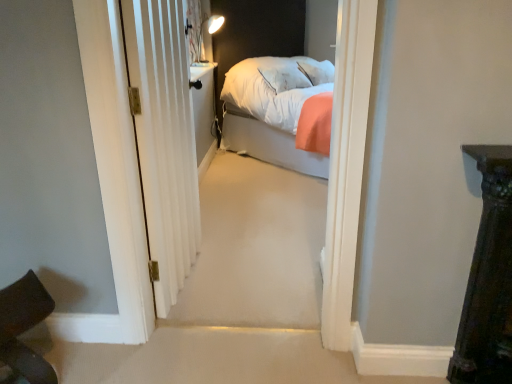
Where is `white textured door at center`? This screenshot has height=384, width=512. white textured door at center is located at coordinates (165, 139).

Describe the element at coordinates (165, 139) in the screenshot. I see `white textured door at center` at that location.

Describe the element at coordinates (24, 329) in the screenshot. I see `dark brown leather chair at lower left` at that location.

You are a GUI agent. You are given a task and a screenshot of the screen. Output one action in this format:
    pyautogui.click(x=<x>, y=<y>)
    Task: Click on the dark brown leather chair at lower left
    The height and width of the screenshot is (384, 512).
    Given the screenshot: What is the action you would take?
    pyautogui.click(x=24, y=329)

Locate an element on the screen. The image size is (512, 384). white textured door at center is located at coordinates click(165, 139).

Is dark brown leather chair at lower left to the right of white textured door at center from the viewer's perspective?

Incorrect, dark brown leather chair at lower left is not on the right side of white textured door at center.

Is dark brown leather chair at lower left positioned behind white textured door at center?

No.

Is point (1, 321) closer or farther from the camera than point (188, 217)?

Point (1, 321).

From the image's perspective, between dark brown leather chair at lower left and white textured door at center, who is located below?

dark brown leather chair at lower left, from the image's perspective.

From a real-world perspective, between dark brown leather chair at lower left and white textured door at center, who is vertically lower?

From a 3D spatial view, dark brown leather chair at lower left is below.

Can you confirm if dark brown leather chair at lower left is wider than white textured door at center?

Yes.

Between dark brown leather chair at lower left and white textured door at center, which one has more height?

Standing taller between the two is white textured door at center.

Between dark brown leather chair at lower left and white textured door at center, which one has larger size?

white textured door at center is bigger.

Is dark brown leather chair at lower left not within white textured door at center?

That's correct, dark brown leather chair at lower left is outside of white textured door at center.

Does dark brown leather chair at lower left touch white textured door at center?

There is a gap between dark brown leather chair at lower left and white textured door at center.

Is dark brown leather chair at lower left positioned with its back to white textured door at center?

No, dark brown leather chair at lower left is not facing away from white textured door at center.

How much distance is there between dark brown leather chair at lower left and white textured door at center?

They are 27.90 inches apart.

Image resolution: width=512 pixels, height=384 pixels. I want to click on door behind the dark brown leather chair at lower left, so click(x=165, y=139).

Is white textured door at center at the right side of dark brown leather chair at lower left?

Yes.

In the scene shown: Which is in front, white textured door at center or dark brown leather chair at lower left?

Positioned in front is dark brown leather chair at lower left.

Does point (160, 90) come farther from viewer compared to point (26, 362)?

That is True.

From the image's perspective, is white textured door at center positioned above or below dark brown leather chair at lower left?

Clearly, from the image's perspective, white textured door at center is above dark brown leather chair at lower left.

From a real-world perspective, between white textured door at center and dark brown leather chair at lower left, who is vertically higher?

In real-world perspective, white textured door at center is above.

Considering the sizes of white textured door at center and dark brown leather chair at lower left in the image, is white textured door at center wider or thinner than dark brown leather chair at lower left?

In the image, white textured door at center appears to be more narrow than dark brown leather chair at lower left.

Is white textured door at center taller than dark brown leather chair at lower left?

Correct, white textured door at center is much taller as dark brown leather chair at lower left.

Based on their sizes in the image, would you say white textured door at center is bigger or smaller than dark brown leather chair at lower left?

white textured door at center is bigger than dark brown leather chair at lower left.

Can we say white textured door at center lies outside dark brown leather chair at lower left?

Yes, white textured door at center is not within dark brown leather chair at lower left.

Can you see white textured door at center touching dark brown leather chair at lower left?

No, white textured door at center is not touching dark brown leather chair at lower left.

Is white textured door at center facing towards dark brown leather chair at lower left?

No, white textured door at center is not oriented towards dark brown leather chair at lower left.

What's the angular difference between white textured door at center and dark brown leather chair at lower left's facing directions?

white textured door at center and dark brown leather chair at lower left are facing 45.3 degrees away from each other.

Find the location of a particular element. This screenshot has height=384, width=512. door above the dark brown leather chair at lower left (from the image's perspective) is located at coordinates (165, 139).

In the image, there is a dark brown leather chair at lower left. Where is `door above it (from the image's perspective)`? Image resolution: width=512 pixels, height=384 pixels. door above it (from the image's perspective) is located at coordinates (165, 139).

Identify the location of door above the dark brown leather chair at lower left (from a real-world perspective). (165, 139).